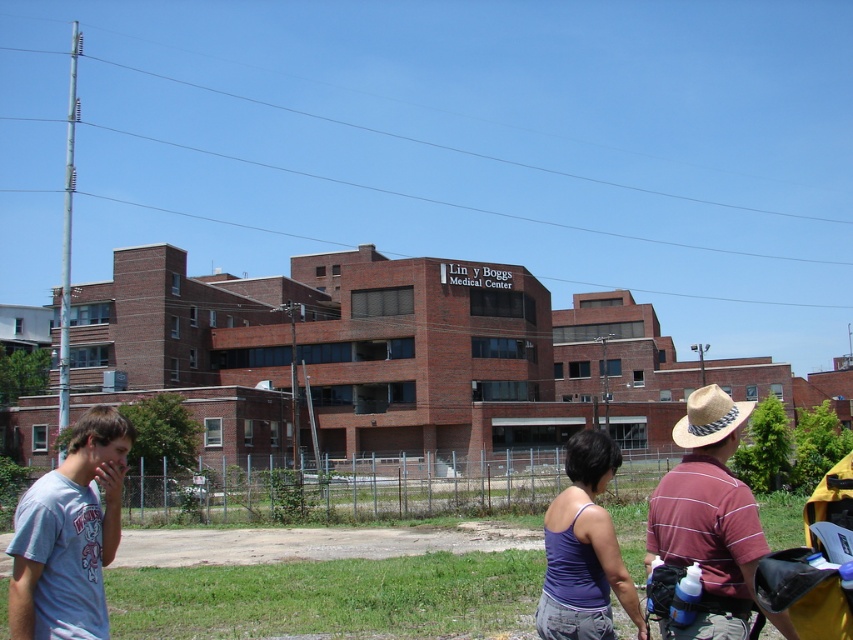
Does light blue t-shirt at left appear under maroon striped shirt at lower right?

No, light blue t-shirt at left is not below maroon striped shirt at lower right.

Who is more forward, (62, 608) or (698, 632)?

Point (698, 632) is more forward.

Is point (97, 556) farther from viewer compared to point (737, 500)?

Yes, it is.

The width and height of the screenshot is (853, 640). I want to click on light blue t-shirt at left, so click(x=68, y=534).